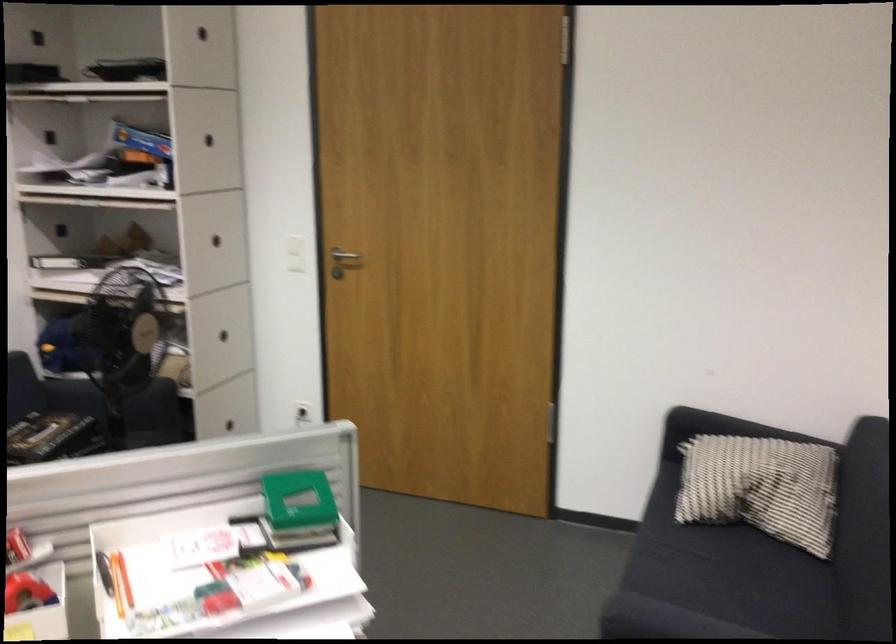
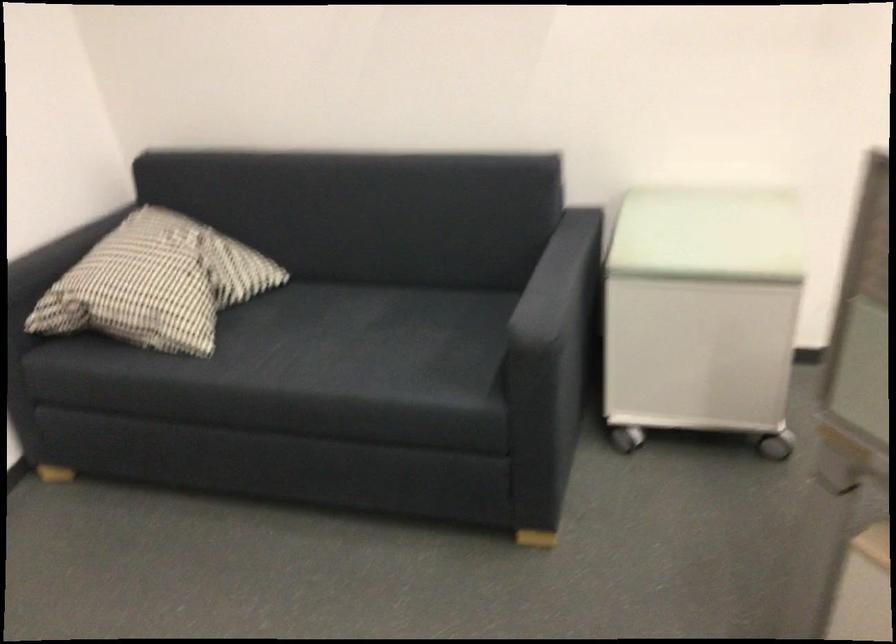
Find the pixel in the second image that matches pixel 716 466 in the first image.

(156, 283)